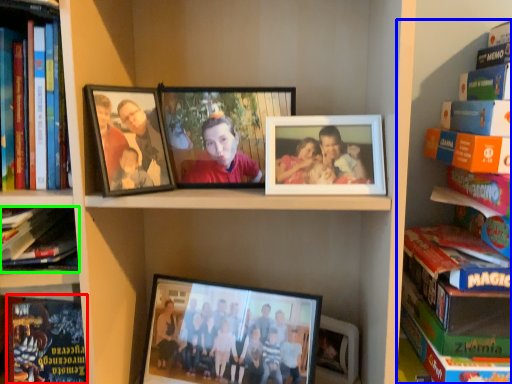
Question: Estimate the real-world distances between objects in this image. Which object is farther from paperback book (highlighted by a red box), book (highlighted by a blue box) or book (highlighted by a green box)?

Choices:
 (A) book
 (B) book

Answer: (A)